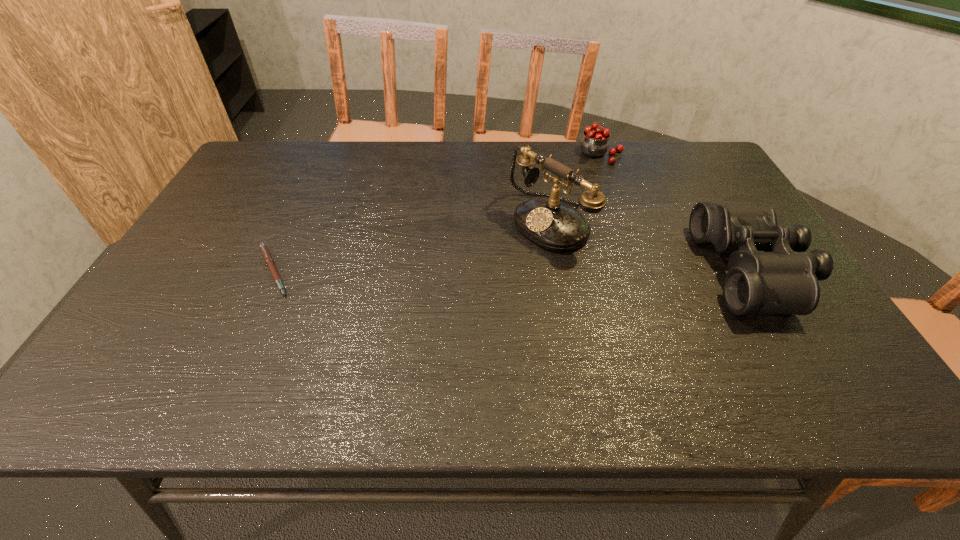
Identify the location of the shortest object. (265, 252).

I want to click on the leftmost object, so click(x=265, y=252).

The width and height of the screenshot is (960, 540). Find the location of `binoculars`. binoculars is located at coordinates (783, 279).

Where is `pot filled with cherries`? The height and width of the screenshot is (540, 960). pot filled with cherries is located at coordinates (594, 143).

Where is `the farthest object`? the farthest object is located at coordinates (594, 143).

Locate an element on the screen. Image resolution: width=960 pixels, height=540 pixels. the second object from left to right is located at coordinates (545, 220).

Identify the location of the tallest object. (545, 220).

I want to click on vacant space located at the nib of the pen, so click(x=358, y=271).

Where is `vacant point located at the eyepieces of the binoculars`? vacant point located at the eyepieces of the binoculars is located at coordinates (563, 270).

In order to click on vacant space located 0.130m at the eyepieces of the binoculars in this screenshot , I will do `click(655, 270)`.